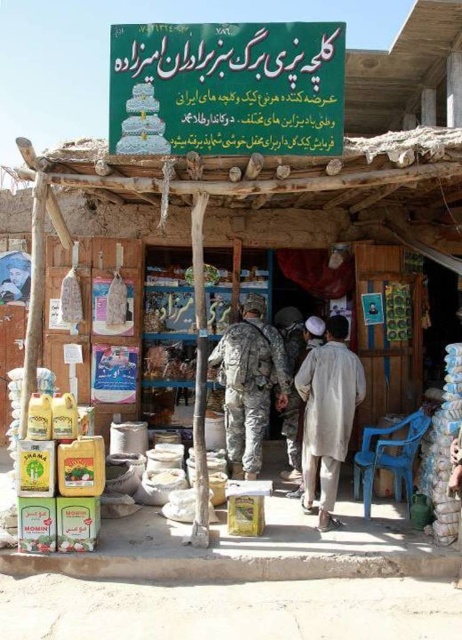
You are a customer entering the rustic shop and want to read the matte plastic signboard at upper center and the light beige fabric at center. Which object is shorter in height?

The matte plastic signboard at upper center is not as tall as the light beige fabric at center, so the matte plastic signboard at upper center is shorter in height.

Based on the scene description, where is the matte plastic signboard at upper center located in terms of its 2D coordinates?

The matte plastic signboard at upper center is located at the 2D coordinates of point (228, 88).